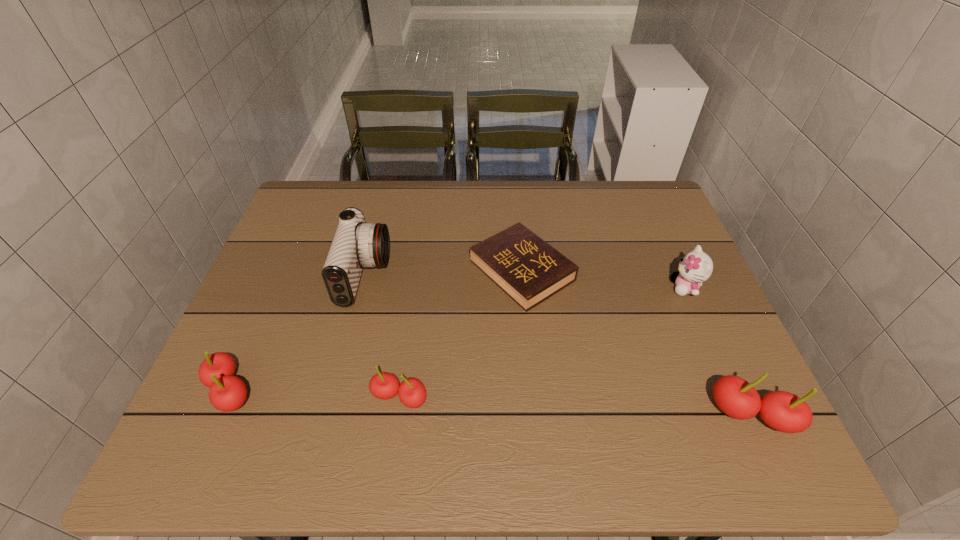
Locate an element on the screen. The width and height of the screenshot is (960, 540). blank space that satisfies the following two spatial constraints: 1. on the front-facing side of the rightmost cherry; 2. on the left side of the kitten is located at coordinates (741, 414).

I want to click on free location that satisfies the following two spatial constraints: 1. on the back side of the leftmost cherry; 2. on the left side of the hardback book, so click(x=283, y=271).

Locate an element on the screen. The width and height of the screenshot is (960, 540). free space that satisfies the following two spatial constraints: 1. on the front side of the rightmost cherry; 2. on the right side of the leftmost cherry is located at coordinates (220, 414).

I want to click on vacant space that satisfies the following two spatial constraints: 1. on the front-facing side of the rightmost cherry; 2. on the left side of the kitten, so click(741, 414).

You are a GUI agent. You are given a task and a screenshot of the screen. Output one action in this format:
    pyautogui.click(x=<x>, y=<y>)
    Task: Click on the vacant area that satisfies the following two spatial constraints: 1. on the surface of the camcorder; 2. on the right side of the rightmost cherry
    Image resolution: width=960 pixels, height=540 pixels.
    Given the screenshot: What is the action you would take?
    pyautogui.click(x=330, y=414)

At what (x,y) coordinates should I click in order to perform the action: click on free space that satisfies the following two spatial constraints: 1. on the front-facing side of the kitten; 2. on the front side of the second shortest object. Please return your answer as a coordinate pair (x, y). Image resolution: width=960 pixels, height=540 pixels. Looking at the image, I should click on (734, 397).

The height and width of the screenshot is (540, 960). Find the location of `free space that satisfies the following two spatial constraints: 1. on the surface of the rightmost cherry; 2. on the left side of the fifth object from right to left`. free space that satisfies the following two spatial constraints: 1. on the surface of the rightmost cherry; 2. on the left side of the fifth object from right to left is located at coordinates (330, 414).

The height and width of the screenshot is (540, 960). In order to click on free space that satisfies the following two spatial constraints: 1. on the surface of the rightmost cherry; 2. on the left side of the second object from left to right in this screenshot , I will do `click(330, 414)`.